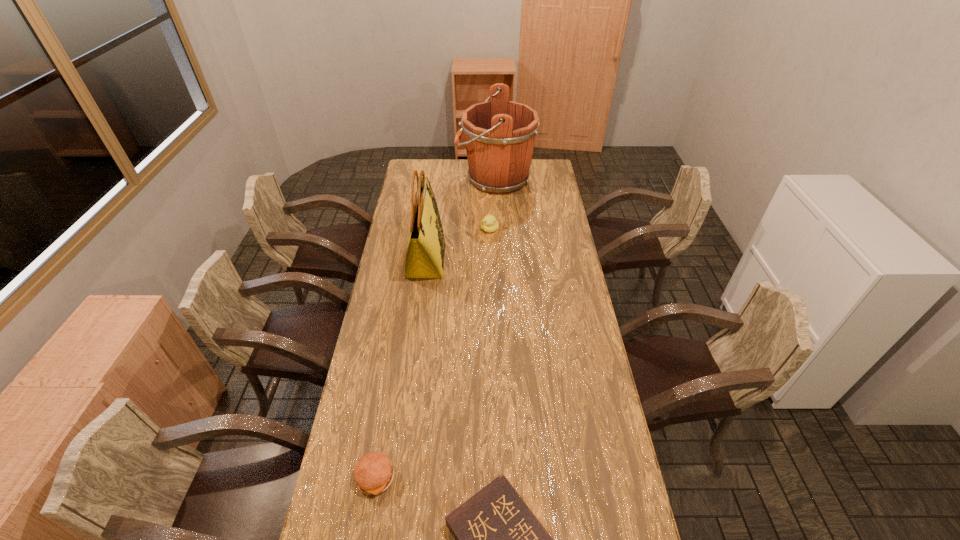
What are the coordinates of `vacant area that lies between the bucket and the fourth tallest object` in the screenshot? It's located at (435, 328).

Image resolution: width=960 pixels, height=540 pixels. I want to click on free spot between the farthest object and the tote bag, so click(x=461, y=220).

The width and height of the screenshot is (960, 540). Identify the location of unoccupied position between the duckling and the hamburger. (432, 353).

In order to click on free space between the hamburger and the bucket in this screenshot , I will do `click(435, 328)`.

Select which object appears as the second closest to the bucket. Please provide its 2D coordinates. Your answer should be formatted as a tuple, i.e. [(x, y)], where the tuple contains the x and y coordinates of a point satisfying the conditions above.

[(425, 253)]

Identify which object is the second closest to the farthest object. Please provide its 2D coordinates. Your answer should be formatted as a tuple, i.e. [(x, y)], where the tuple contains the x and y coordinates of a point satisfying the conditions above.

[(425, 253)]

Locate an element on the screen. The height and width of the screenshot is (540, 960). vacant space that satisfies the following two spatial constraints: 1. at the beak of the duckling; 2. on the front-facing side of the tote bag is located at coordinates (491, 260).

Find the location of a particular element. Image resolution: width=960 pixels, height=540 pixels. vacant area that satisfies the following two spatial constraints: 1. at the beak of the duckling; 2. on the front-facing side of the tote bag is located at coordinates (491, 260).

At what (x,y) coordinates should I click in order to perform the action: click on free space that satisfies the following two spatial constraints: 1. with the handle on the side of the farthest object; 2. at the beak of the duckling. Please return your answer as a coordinate pair (x, y). Looking at the image, I should click on (497, 230).